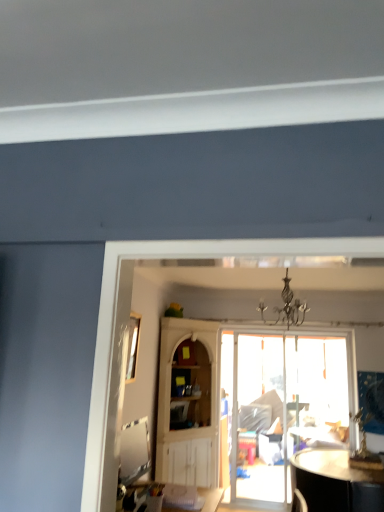
Question: In terms of height, does clear glass window at upper left look taller or shorter compared to translucent glass door at center?

Choices:
 (A) tall
 (B) short

Answer: (B)

Question: In terms of size, does clear glass window at upper left appear bigger or smaller than translucent glass door at center?

Choices:
 (A) big
 (B) small

Answer: (B)

Question: Which object is the farthest from the black wrought iron chandelier at center?

Choices:
 (A) clear glass window at upper left
 (B) translucent glass door at center
 (C) white wood cabinet at center

Answer: (B)

Question: Which is nearer to the translucent glass door at center?

Choices:
 (A) black wrought iron chandelier at center
 (B) clear glass window at upper left
 (C) white wood cabinet at center

Answer: (C)